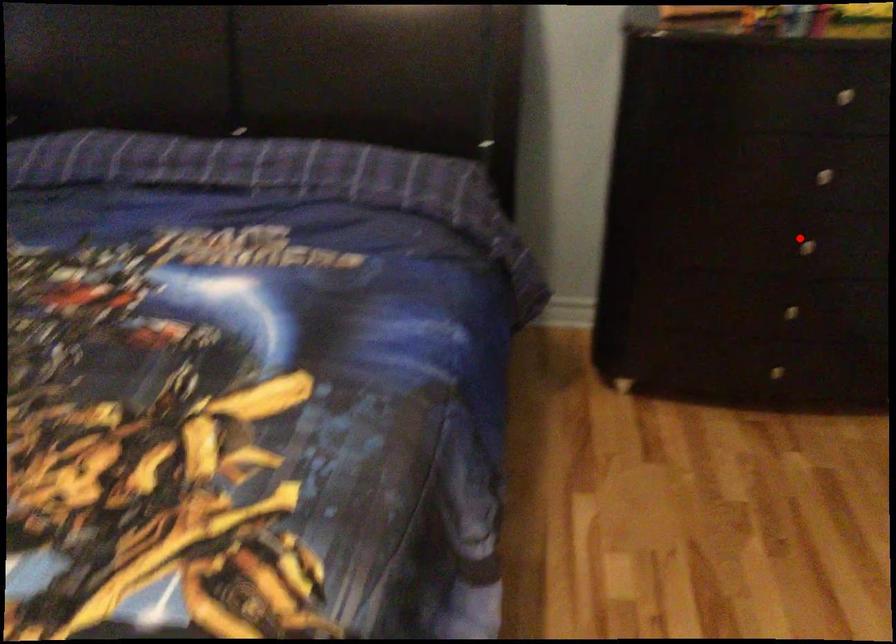
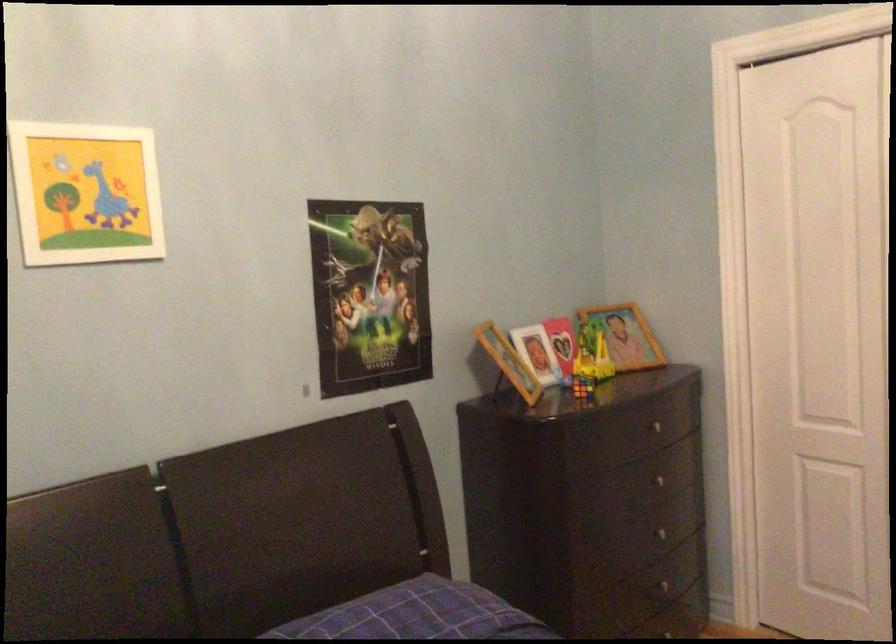
The point at the highlighted location is marked in the first image. Where is the corresponding point in the second image?

(667, 532)